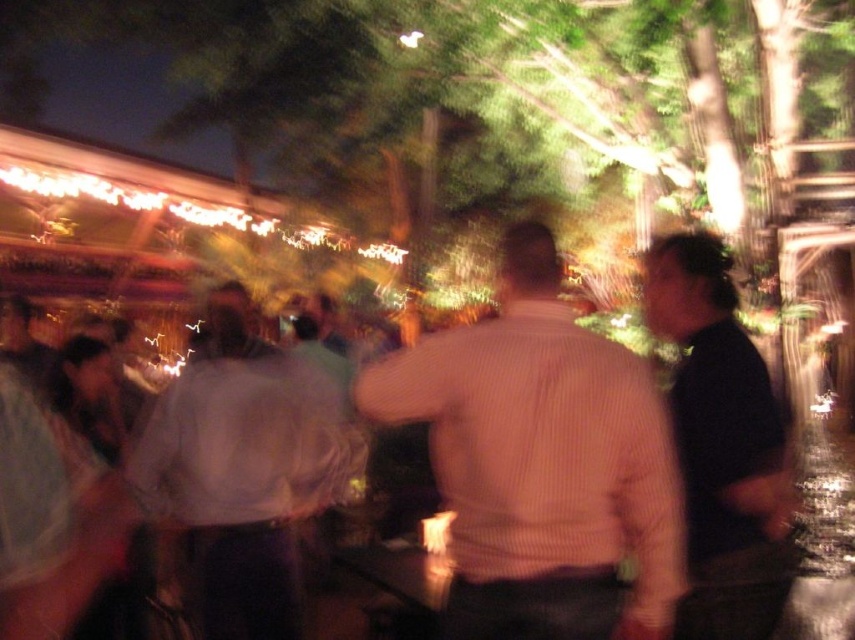
Which is above, white cotton shirt at center or black matte shirt at right?

black matte shirt at right is above.

Between white cotton shirt at center and black matte shirt at right, which one has more height?

Standing taller between the two is white cotton shirt at center.

Which is in front, point (256, 580) or point (687, 358)?

Point (687, 358) is more forward.

At what (x,y) coordinates should I click in order to perform the action: click on white cotton shirt at center. Please return your answer as a coordinate pair (x, y). Looking at the image, I should click on (245, 470).

Who is shorter, light brown striped shirt at center or white cotton shirt at center?

light brown striped shirt at center

Who is more distant from viewer, (540, 472) or (164, 465)?

The point (164, 465) is more distant.

Which is in front, point (405, 387) or point (340, 442)?

Positioned in front is point (405, 387).

The image size is (855, 640). Identify the location of light brown striped shirt at center. (541, 461).

In the scene shown: Which is more to the left, light brown wood table at center or white cotton shirt at center?

white cotton shirt at center

You are a GUI agent. You are given a task and a screenshot of the screen. Output one action in this format:
    pyautogui.click(x=<x>, y=<y>)
    Task: Click on the light brown wood table at center
    The image size is (855, 640).
    Given the screenshot: What is the action you would take?
    pyautogui.click(x=587, y=460)